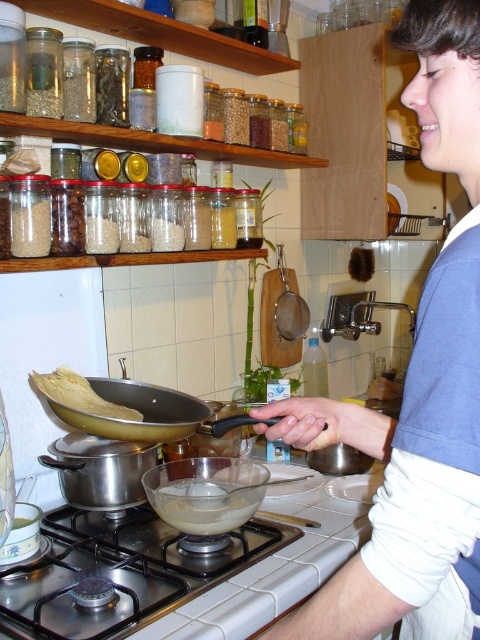
Question: Which of the following is the farthest from the observer?

Choices:
 (A) gold matte wok at center
 (B) translucent glass bowl at center
 (C) blue cotton shirt at upper right

Answer: (B)

Question: Does gold matte wok at center have a greater width compared to yellow matte pancake at center?

Choices:
 (A) no
 (B) yes

Answer: (B)

Question: Among these objects, which one is nearest to the camera?

Choices:
 (A) yellow matte pancake at center
 (B) gold matte wok at center
 (C) translucent glass bowl at center

Answer: (B)

Question: Which object is positioned closest to the translucent glass bowl at center?

Choices:
 (A) gold matte wok at center
 (B) stainless steel gas stove at lower center
 (C) blue cotton shirt at upper right

Answer: (B)

Question: Considering the relative positions of blue cotton shirt at upper right and gold matte wok at center in the image provided, where is blue cotton shirt at upper right located with respect to gold matte wok at center?

Choices:
 (A) left
 (B) right

Answer: (B)

Question: Can you confirm if stainless steel gas stove at lower center is positioned below translucent glass bowl at center?

Choices:
 (A) yes
 (B) no

Answer: (A)